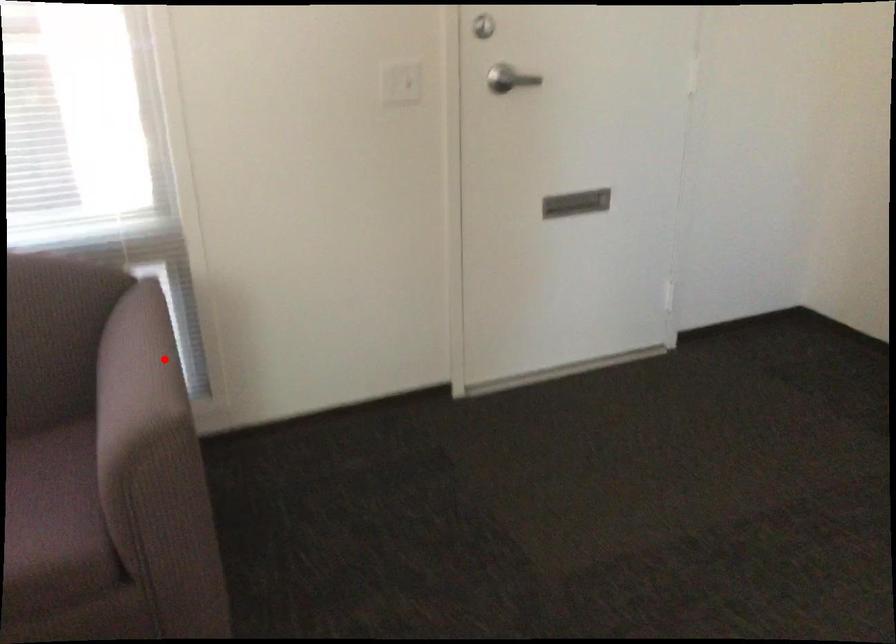
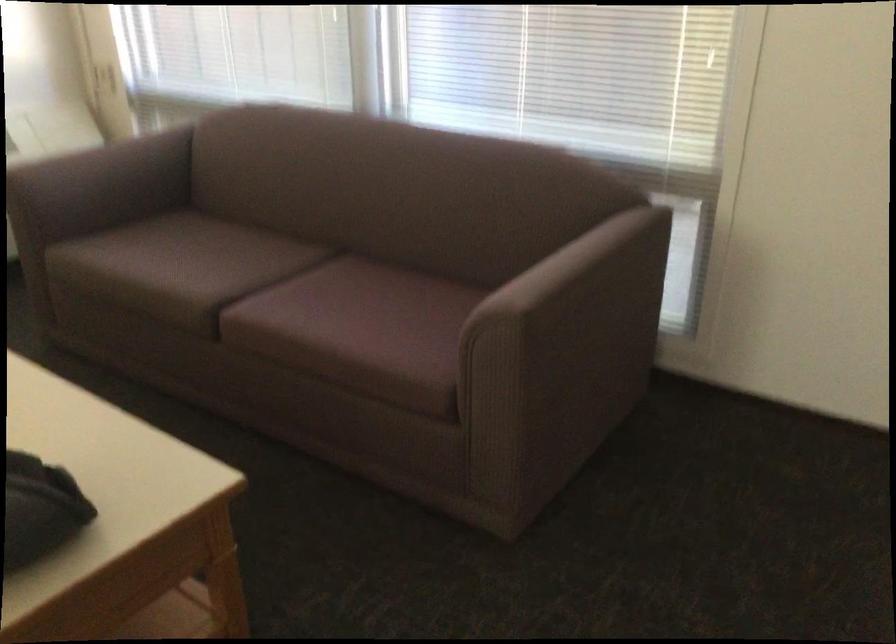
Question: I am providing you with two images of the same scene from different viewpoints. Image1 has a red point marked. In image2, the corresponding 3D location appears at what relative position? Reply with the corresponding letter.

Choices:
 (A) Closer
 (B) Farther

Answer: (B)